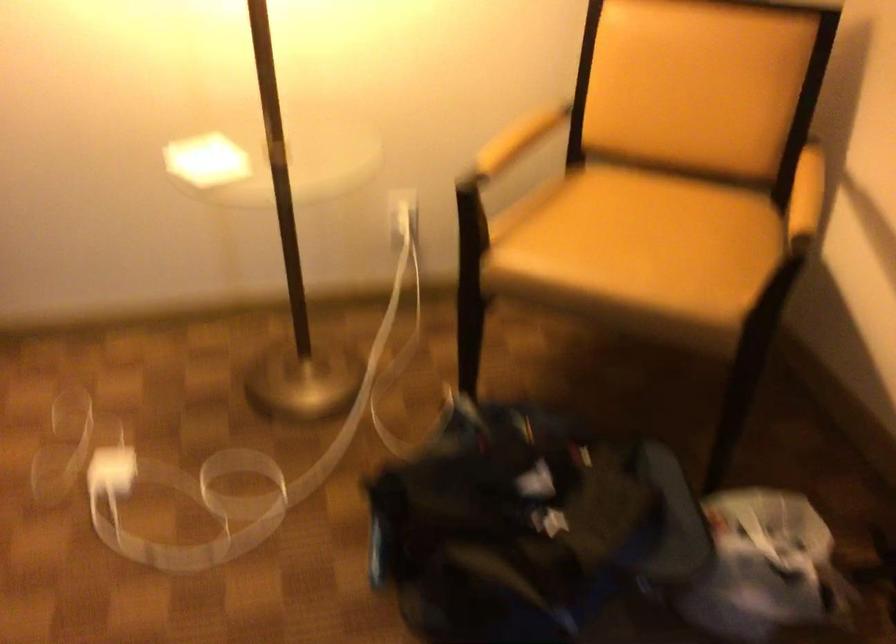
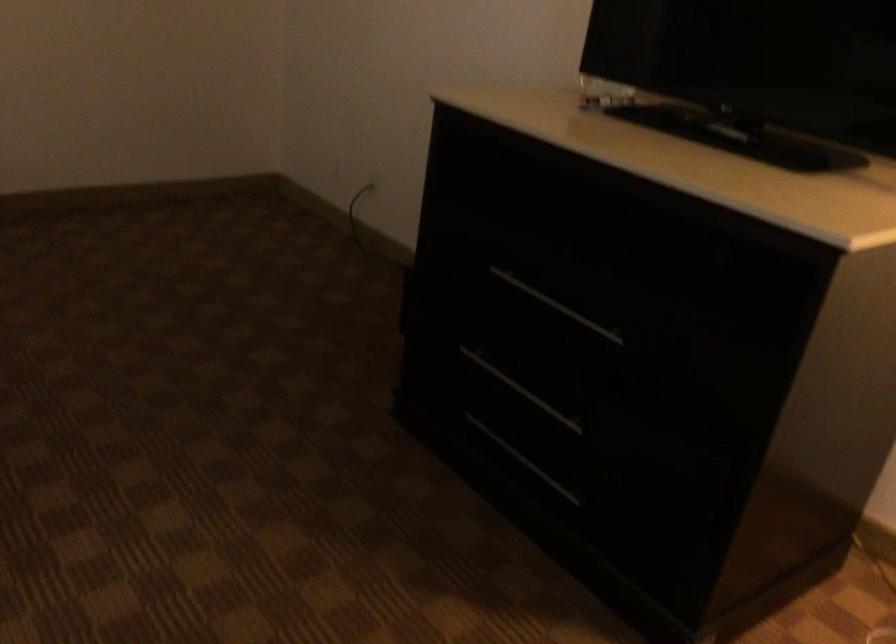
Question: The first image is from the beginning of the video and the second image is from the end. How did the camera likely rotate when shooting the video?

Choices:
 (A) Left
 (B) Right
 (C) Up
 (D) Down

Answer: (A)